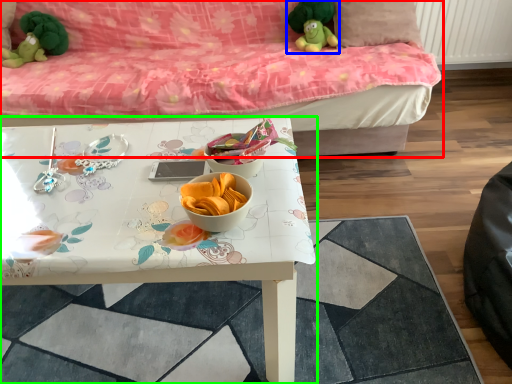
Question: Which is farther away from studio couch (highlighted by a red box)? toy (highlighted by a blue box) or table (highlighted by a green box)?

Choices:
 (A) toy
 (B) table

Answer: (B)